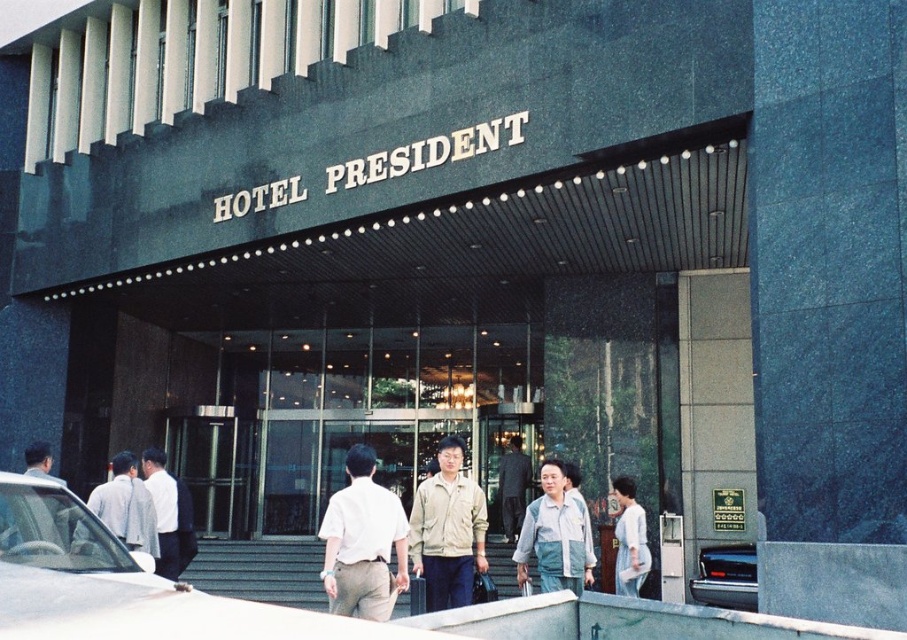
Is point (125, 468) closer to viewer compared to point (752, 570)?

Yes, point (125, 468) is closer to viewer.

Locate an element on the screen. This screenshot has width=907, height=640. light gray cotton shirt at left is located at coordinates (125, 506).

Consider the image. Is white cotton shirt at center positioned before dark gray suit at center?

Yes, white cotton shirt at center is in front of dark gray suit at center.

Between white cotton shirt at center and dark gray suit at center, which one has more height?

dark gray suit at center

Is point (386, 593) positioned before point (505, 490)?

Yes, point (386, 593) is in front of point (505, 490).

You are a GUI agent. You are given a task and a screenshot of the screen. Output one action in this format:
    pyautogui.click(x=<x>, y=<y>)
    Task: Click on the white cotton shirt at center
    Image resolution: width=907 pixels, height=640 pixels.
    Given the screenshot: What is the action you would take?
    pyautogui.click(x=363, y=541)

Based on the photo, between khaki fabric jacket at center and white matte shirt at center, which one has more height?

khaki fabric jacket at center is taller.

This screenshot has width=907, height=640. Describe the element at coordinates (447, 531) in the screenshot. I see `khaki fabric jacket at center` at that location.

Is point (434, 529) less distant than point (641, 515)?

Yes, point (434, 529) is closer to viewer.

Locate an element on the screen. Image resolution: width=907 pixels, height=640 pixels. khaki fabric jacket at center is located at coordinates (447, 531).